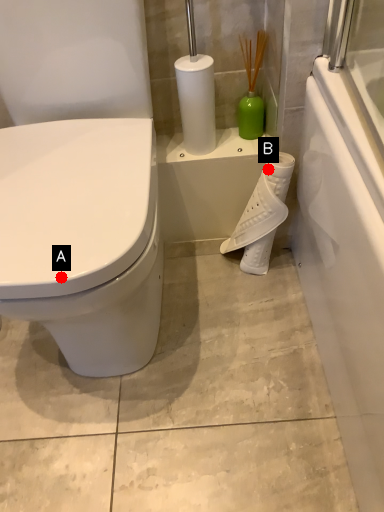
Question: Two points are circled on the image, labeled by A and B beside each circle. Which point appears closest to the camera in this image?

Choices:
 (A) A is closer
 (B) B is closer

Answer: (A)